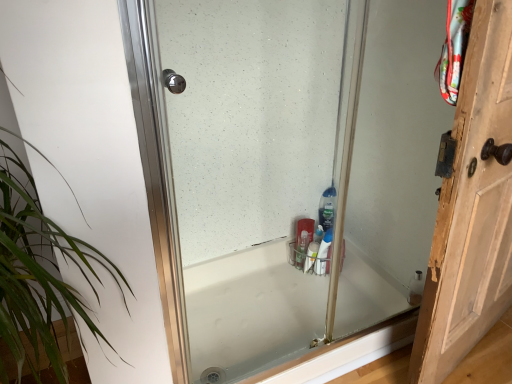
You are a GUI agent. You are given a task and a screenshot of the screen. Output one action in this format:
    pyautogui.click(x=<x>, y=<y>)
    Task: Click on the free space below white glossy bathtub at center (from a real-world perspective)
    This screenshot has width=512, height=384.
    Given the screenshot: What is the action you would take?
    pyautogui.click(x=268, y=314)